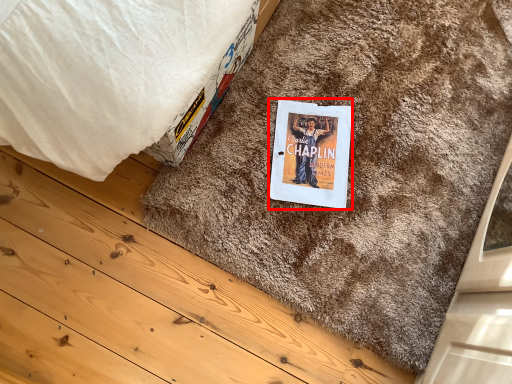
Question: Where is paperback book (annotated by the red box) located in relation to doormat in the image?

Choices:
 (A) left
 (B) right

Answer: (A)